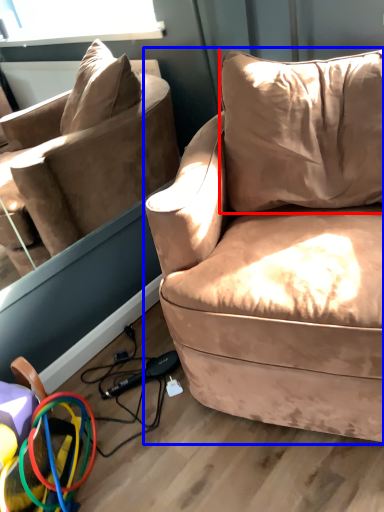
Question: Which point is closer to the camera, pillow (highlighted by a red box) or studio couch (highlighted by a blue box)?

Choices:
 (A) pillow
 (B) studio couch

Answer: (B)